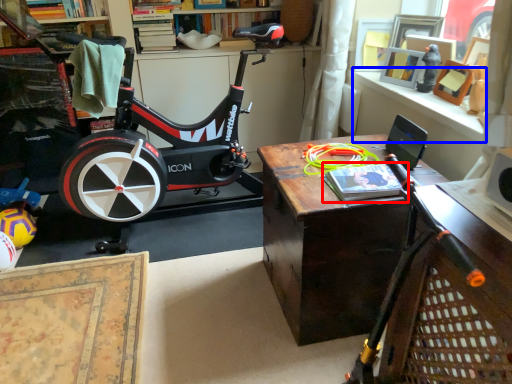
Question: Which point is further to the camera, book (highlighted by a red box) or window sill (highlighted by a blue box)?

Choices:
 (A) book
 (B) window sill

Answer: (B)